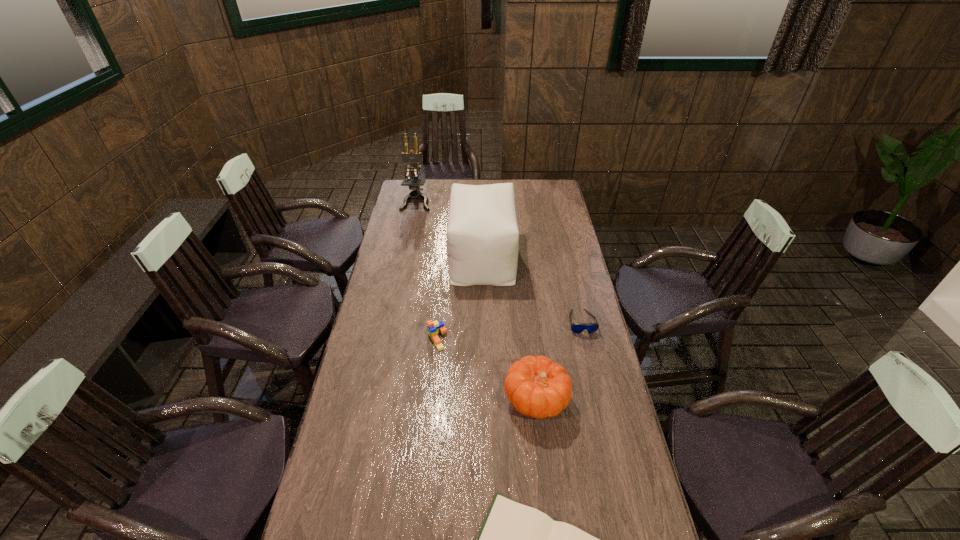
The width and height of the screenshot is (960, 540). I want to click on vacant region at the far edge of the desktop, so click(x=525, y=198).

Image resolution: width=960 pixels, height=540 pixels. I want to click on free region at the left edge of the desktop, so click(x=408, y=273).

Locate an element on the screen. Image resolution: width=960 pixels, height=540 pixels. free space at the right edge is located at coordinates point(605,387).

You are a GUI agent. You are given a task and a screenshot of the screen. Output one action in this format:
    pyautogui.click(x=<x>, y=<y>)
    Task: Click on the empty space between the fifth farthest object and the cushion
    This screenshot has width=960, height=540.
    Given the screenshot: What is the action you would take?
    pyautogui.click(x=510, y=328)

What are the coordinates of `free space between the second farthest object and the third tallest object` in the screenshot? It's located at (510, 328).

The image size is (960, 540). Find the location of `free area in between the sunglasses and the fourth shortest object`. free area in between the sunglasses and the fourth shortest object is located at coordinates (559, 361).

At what (x,y) coordinates should I click in order to perform the action: click on blank region between the fourth shortest object and the sunglasses. Please return your answer as a coordinate pair (x, y). This screenshot has height=540, width=960. Looking at the image, I should click on (559, 361).

Where is `unoccupied area between the Lego and the sunglasses`? unoccupied area between the Lego and the sunglasses is located at coordinates (509, 330).

Locate which object ranks in proximity to the fourth shortest object. Please provide its 2D coordinates. Your answer should be formatted as a tuple, i.e. [(x, y)], where the tuple contains the x and y coordinates of a point satisfying the conditions above.

[(577, 328)]

Locate which object is the fourth closest to the Lego. Please provide its 2D coordinates. Your answer should be formatted as a tuple, i.e. [(x, y)], where the tuple contains the x and y coordinates of a point satisfying the conditions above.

[(515, 539)]